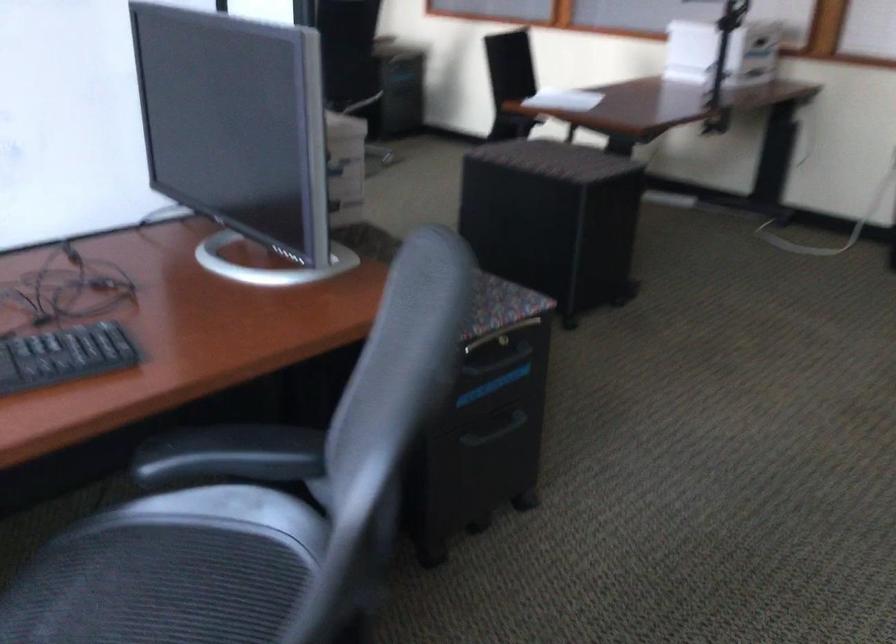
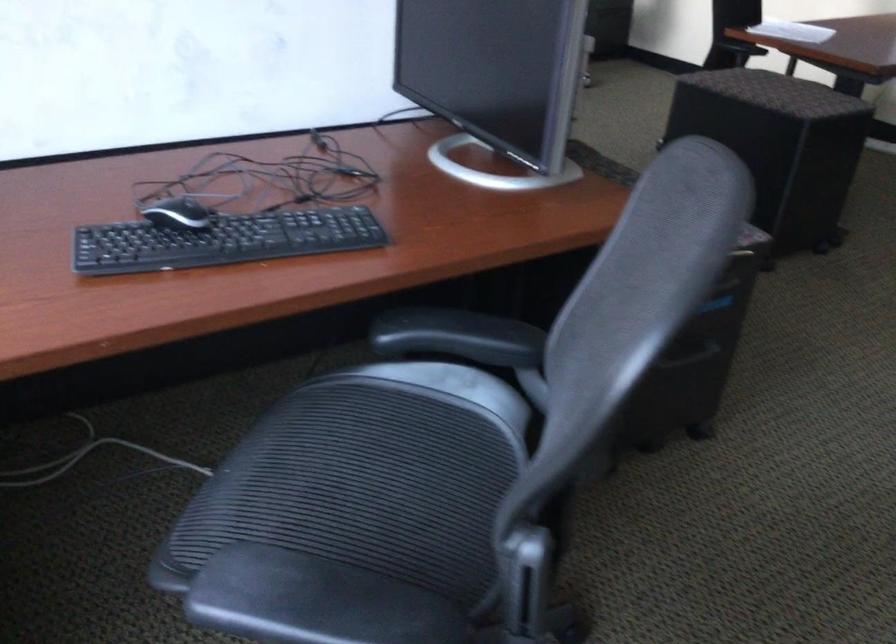
Locate, in the second image, the point that corresponds to pixel 228 456 in the first image.

(458, 337)